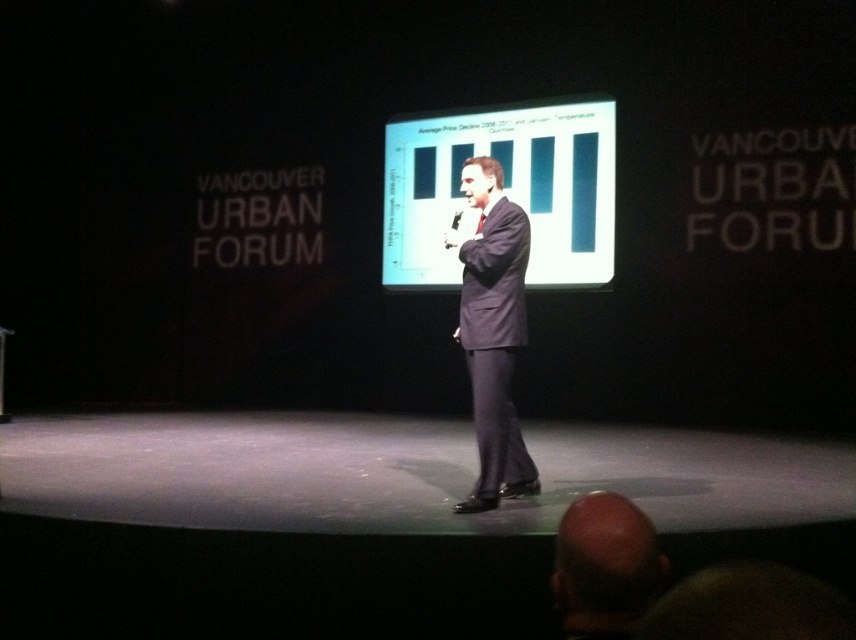
Question: Does matte white graph at center appear on the right side of smooth bald head at lower center?

Choices:
 (A) yes
 (B) no

Answer: (A)

Question: Does matte white graph at center have a larger size compared to black plastic microphone at center?

Choices:
 (A) yes
 (B) no

Answer: (A)

Question: Which object appears closest to the camera in this image?

Choices:
 (A) matte white graph at center
 (B) black plastic microphone at center
 (C) smooth bald head at lower center

Answer: (C)

Question: Estimate the real-world distances between objects in this image. Which object is closer to the black plastic microphone at center?

Choices:
 (A) dark suit at center
 (B) matte white graph at center
 (C) smooth bald head at lower center

Answer: (A)

Question: Considering the relative positions of smooth bald head at lower center and black plastic microphone at center in the image provided, where is smooth bald head at lower center located with respect to black plastic microphone at center?

Choices:
 (A) left
 (B) right

Answer: (B)

Question: Which object is positioned closest to the dark suit at center?

Choices:
 (A) smooth bald head at lower center
 (B) matte white graph at center

Answer: (A)